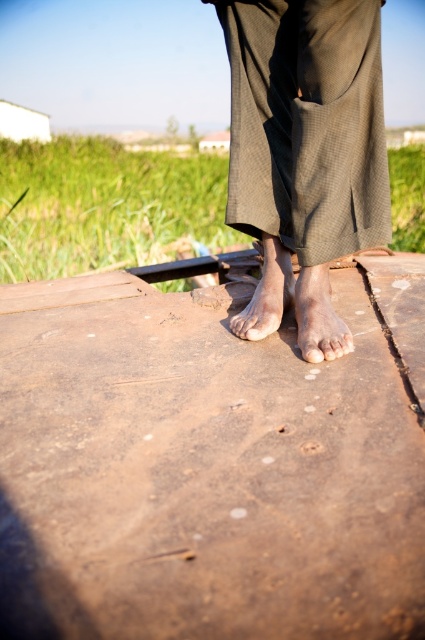
You are a physical therapist examining the image of a person standing on a wooden surface. You notice the dry skin foot at center. Based on the coordinates provided in the Objects Description, can you determine if the foot is positioned closer to the front or the back of the wooden surface?

The dry skin foot at center is located at point coordinates (319, 317). Since the y coordinate 0.751 is closer to 1.0, which typically represents the bottom of the image, this indicates the foot is positioned closer to the back of the wooden surface.